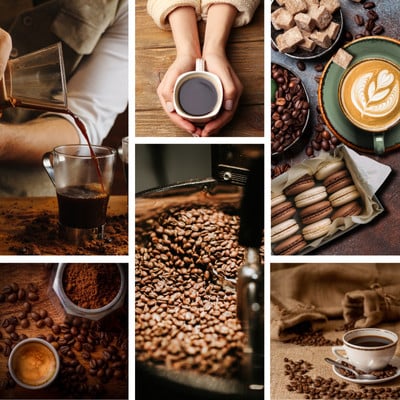
Find the location of `coffee pictures`. coffee pictures is located at coordinates (66, 332), (68, 196), (191, 94), (210, 238), (329, 324), (331, 172).